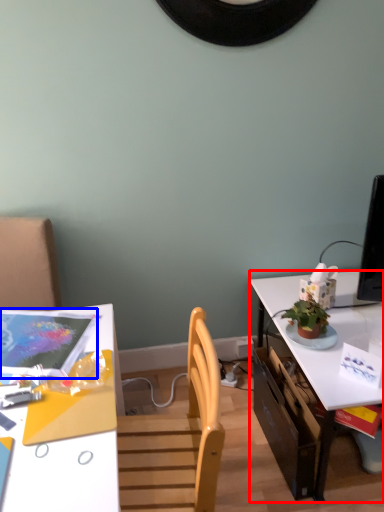
Question: Which object is closer to the camera taking this photo, table (highlighted by a red box) or magazine (highlighted by a blue box)?

Choices:
 (A) table
 (B) magazine

Answer: (B)